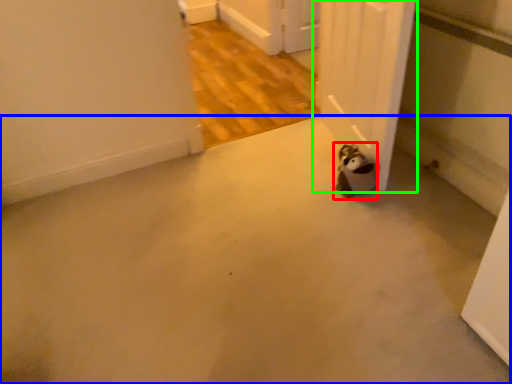
Question: Which object is the farthest from animal (highlighted by a red box)? Choose among these: concrete (highlighted by a blue box) or door (highlighted by a green box).

Choices:
 (A) concrete
 (B) door

Answer: (A)